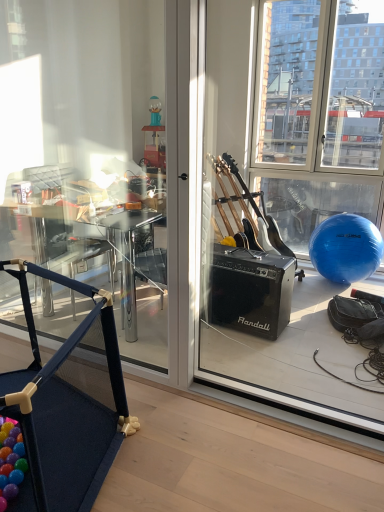
What do you see at coordinates (278, 417) in the screenshot? The width and height of the screenshot is (384, 512). I see `wooden floor at lower left` at bounding box center [278, 417].

This screenshot has height=512, width=384. I want to click on wooden floor at lower left, so click(x=278, y=417).

You are a GUI agent. You are given a task and a screenshot of the screen. Output one action in this format:
    pyautogui.click(x=<x>, y=<y>)
    Task: Click on the blue fabric playpen at lower left
    The width and height of the screenshot is (384, 512).
    Given the screenshot: What is the action you would take?
    pyautogui.click(x=65, y=410)

The height and width of the screenshot is (512, 384). I want to click on transparent glass window screen at right, so click(x=289, y=201).

From the image's perspective, is transparent glass window screen at right positioned above or below wooden floor at lower left?

Clearly, from the image's perspective, transparent glass window screen at right is above wooden floor at lower left.

Considering the positions of objects transparent glass window screen at right and wooden floor at lower left in the image provided, who is more to the left, transparent glass window screen at right or wooden floor at lower left?

From the viewer's perspective, wooden floor at lower left appears more on the left side.

The image size is (384, 512). In the image, there is a transparent glass window screen at right. Identify the location of window sill below it (from the image's perspective). (278, 417).

Which point is more distant from viewer, (352,60) or (28,344)?

The point (352,60) is behind.

Based on the photo, is blue fabric playpen at lower left bigger or smaller than transparent glass window screen at right?

In the image, blue fabric playpen at lower left appears to be larger than transparent glass window screen at right.

Could you tell me if blue fabric playpen at lower left is turned towards transparent glass window screen at right?

No, blue fabric playpen at lower left is not oriented towards transparent glass window screen at right.

Considering the sizes of blue fabric playpen at lower left and transparent glass window screen at right in the image, is blue fabric playpen at lower left taller or shorter than transparent glass window screen at right?

In the image, blue fabric playpen at lower left appears to be shorter than transparent glass window screen at right.

Is blue fabric playpen at lower left in front of or behind transparent glass window screen at right in the image?

In the image, blue fabric playpen at lower left appears in front of transparent glass window screen at right.

Looking at this image, in terms of size, does transparent glass window screen at right appear bigger or smaller than blue fabric playpen at lower left?

Clearly, transparent glass window screen at right is smaller in size than blue fabric playpen at lower left.

From the image's perspective, is transparent glass window screen at right located beneath blue fabric playpen at lower left?

No, from the image's perspective, transparent glass window screen at right is not below blue fabric playpen at lower left.

Is transparent glass window screen at right closer to camera compared to blue fabric playpen at lower left?

No, it is behind blue fabric playpen at lower left.

This screenshot has height=512, width=384. I want to click on window sill in front of the transparent glass window screen at right, so click(278, 417).

Is wooden floor at lower left oriented away from transparent glass window screen at right?

wooden floor at lower left is not turned away from transparent glass window screen at right.

Can you confirm if wooden floor at lower left is bigger than transparent glass window screen at right?

Actually, wooden floor at lower left might be smaller than transparent glass window screen at right.

Based on the photo, is wooden floor at lower left situated inside blue fabric playpen at lower left or outside?

wooden floor at lower left exists outside the volume of blue fabric playpen at lower left.

From a real-world perspective, is wooden floor at lower left positioned under blue fabric playpen at lower left based on gravity?

Yes, from a real-world perspective, wooden floor at lower left is below blue fabric playpen at lower left.

Is wooden floor at lower left thinner than blue fabric playpen at lower left?

No, wooden floor at lower left is not thinner than blue fabric playpen at lower left.

Which is more to the right, blue fabric playpen at lower left or wooden floor at lower left?

From the viewer's perspective, wooden floor at lower left appears more on the right side.

Is wooden floor at lower left at the back of blue fabric playpen at lower left?

No, blue fabric playpen at lower left's orientation is not away from wooden floor at lower left.

How different are the orientations of blue fabric playpen at lower left and wooden floor at lower left in degrees?

0.00164 degrees.

Locate an element on the screen. This screenshot has width=384, height=512. window sill in front of the transparent glass window screen at right is located at coordinates (278, 417).

The width and height of the screenshot is (384, 512). In the image, there is a transparent glass window screen at right. What are the coordinates of `furniture below it (from the image's perspective)` in the screenshot? It's located at (65, 410).

From the image, which object appears to be nearer to wooden floor at lower left, blue fabric playpen at lower left or transparent glass window screen at right?

Based on the image, blue fabric playpen at lower left appears to be nearer to wooden floor at lower left.

Consider the image. Considering their positions, is wooden floor at lower left positioned further to blue fabric playpen at lower left than transparent glass window screen at right?

The object further to blue fabric playpen at lower left is transparent glass window screen at right.

Estimate the real-world distances between objects in this image. Which object is closer to transparent glass window screen at right, wooden floor at lower left or blue fabric playpen at lower left?

wooden floor at lower left is closer to transparent glass window screen at right.

From the image, which object appears to be farther from blue fabric playpen at lower left, transparent glass window screen at right or wooden floor at lower left?

Based on the image, transparent glass window screen at right appears to be further to blue fabric playpen at lower left.

Estimate the real-world distances between objects in this image. Which object is further from wooden floor at lower left, transparent glass window screen at right or blue fabric playpen at lower left?

transparent glass window screen at right.

Estimate the real-world distances between objects in this image. Which object is further from transparent glass window screen at right, blue fabric playpen at lower left or wooden floor at lower left?

The object further to transparent glass window screen at right is blue fabric playpen at lower left.

Find the location of `window sill between blue fabric playpen at lower left and transparent glass window screen at right from left to right`. window sill between blue fabric playpen at lower left and transparent glass window screen at right from left to right is located at coordinates (x=278, y=417).